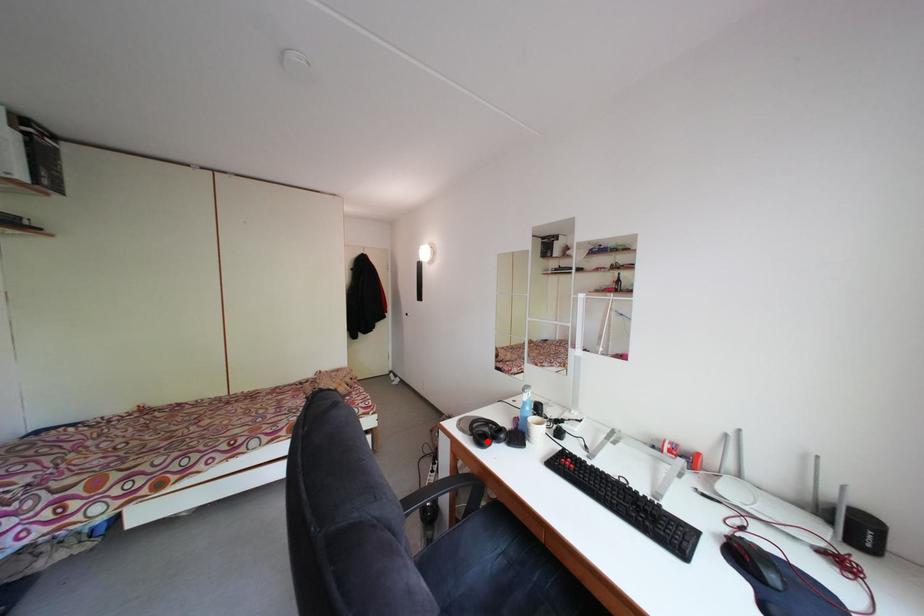
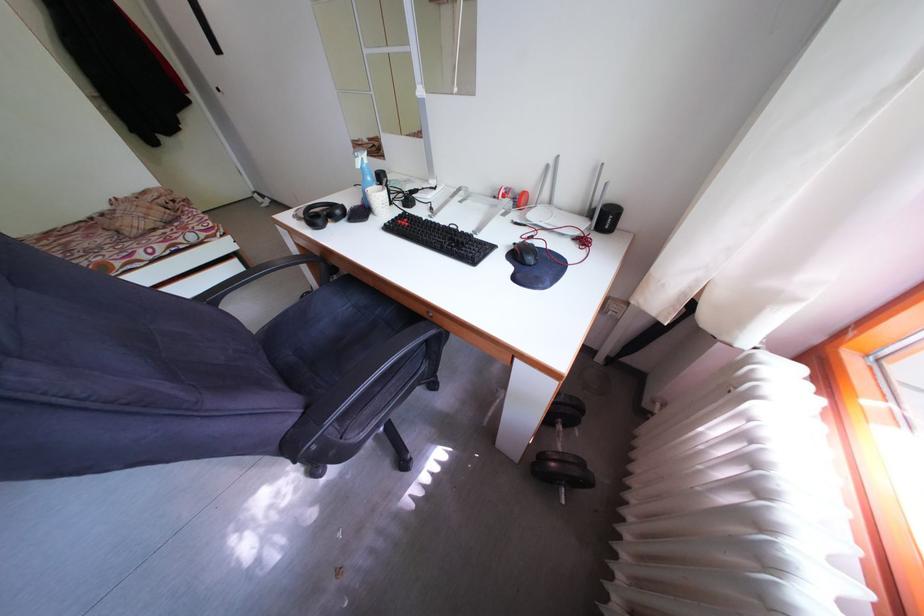
In the second image, find the point that corresponds to the highlighted location in the first image.

(321, 223)